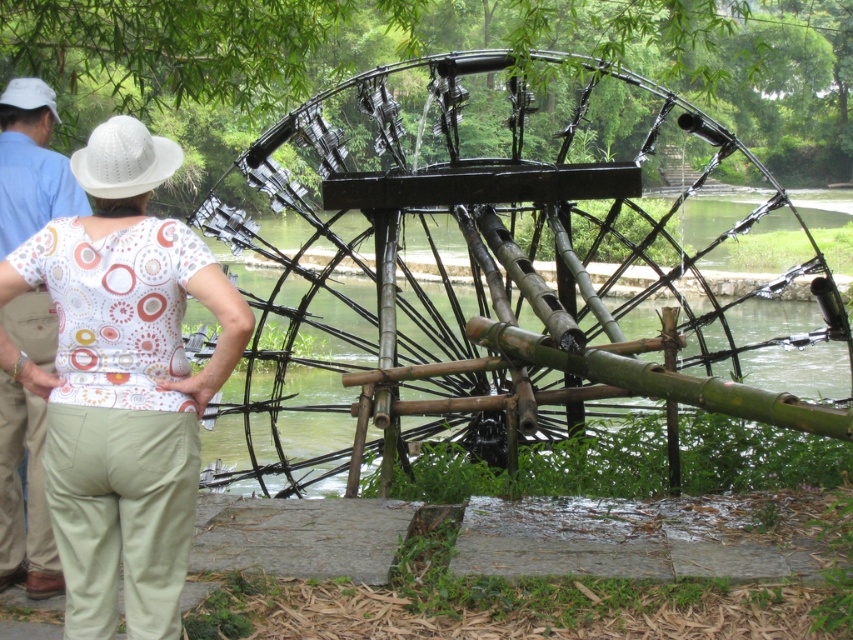
You are a visitor at the waterwheel site and want to take a photo of the black bamboo waterwheel at center and the white printed blouse at upper left. Which object should you focus on first if you want to capture both in the same frame without moving the camera?

The black bamboo waterwheel at center is taller than the white printed blouse at upper left, so you should focus on the black bamboo waterwheel at center first to ensure both are in frame.

You are standing at the point with coordinates point (3, 320) and want to move to the point with coordinates point (65, 577). Based on the scene description, which direction should you move to reach your destination?

You should move forward because point (65, 577) is in front of point (3, 320).